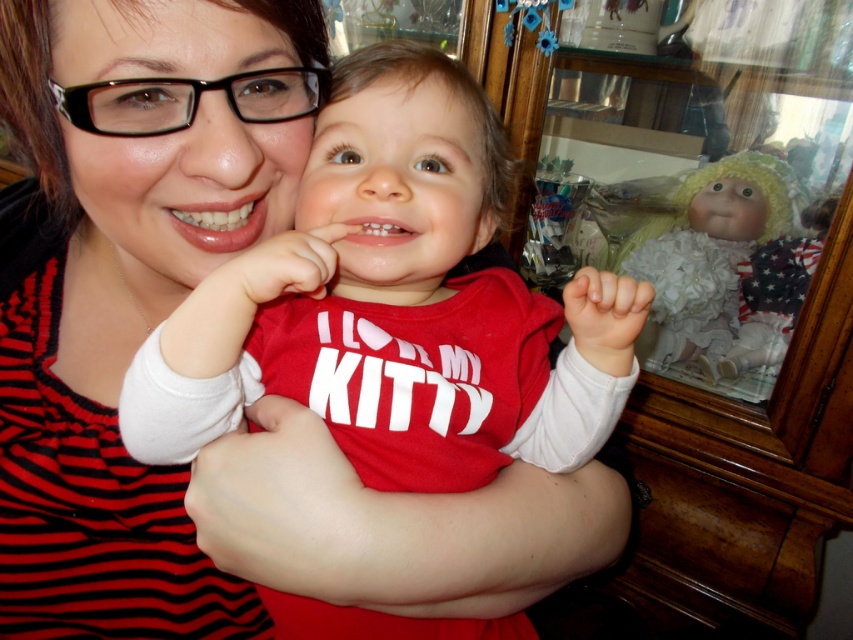
Is matte red shirt at center above matte black glasses at upper left?

Incorrect, matte red shirt at center is not positioned above matte black glasses at upper left.

Is matte red shirt at center below matte black glasses at upper left?

Yes, matte red shirt at center is below matte black glasses at upper left.

Who is more forward, (402,305) or (109,296)?

Positioned in front is point (402,305).

Where is `matte red shirt at center`? The height and width of the screenshot is (640, 853). matte red shirt at center is located at coordinates (393, 305).

Does point (494, 115) come behind point (685, 266)?

No, (494, 115) is closer to viewer.

Is matte red shirt at center to the right of white fluffy doll at right from the viewer's perspective?

Incorrect, matte red shirt at center is not on the right side of white fluffy doll at right.

Locate an element on the screen. matte red shirt at center is located at coordinates (393, 305).

Where is `matte red shirt at center`? The width and height of the screenshot is (853, 640). matte red shirt at center is located at coordinates (393, 305).

Does matte black glasses at upper left have a lesser height compared to white fluffy doll at right?

In fact, matte black glasses at upper left may be taller than white fluffy doll at right.

Locate an element on the screen. matte black glasses at upper left is located at coordinates (120, 310).

Locate an element on the screen. matte black glasses at upper left is located at coordinates (120, 310).